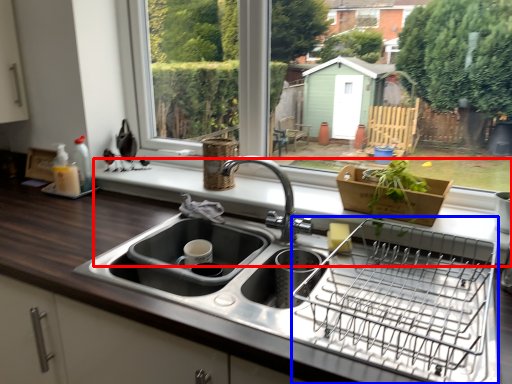
Question: Among these objects, which one is farthest to the camera, window sill (highlighted by a red box) or appliance (highlighted by a blue box)?

Choices:
 (A) window sill
 (B) appliance

Answer: (A)